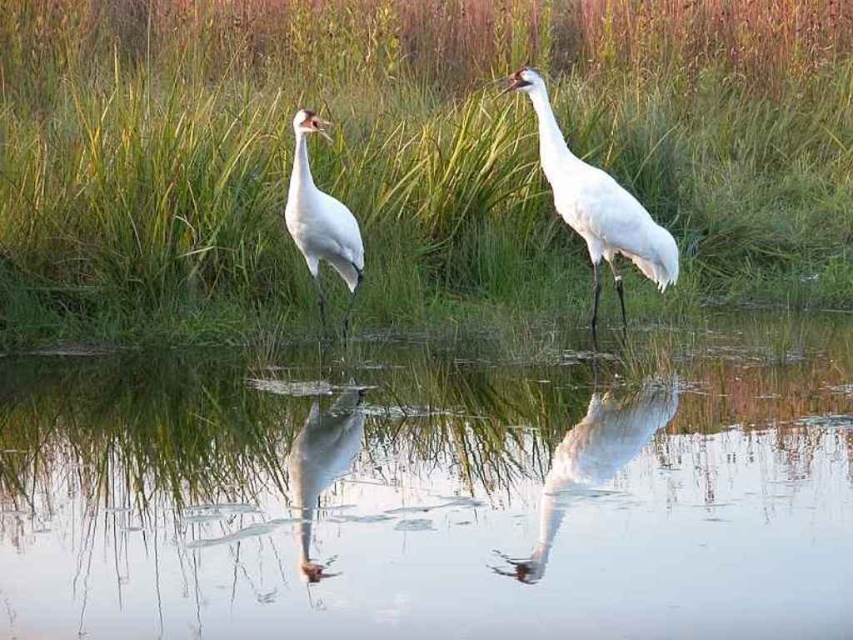
Between white feathered crane at upper center and white feathered crane at left, which one appears on the right side from the viewer's perspective?

white feathered crane at upper center

Can you confirm if white feathered crane at upper center is smaller than white feathered crane at left?

Incorrect, white feathered crane at upper center is not smaller in size than white feathered crane at left.

Describe the element at coordinates (596, 204) in the screenshot. I see `white feathered crane at upper center` at that location.

Image resolution: width=853 pixels, height=640 pixels. Find the location of `white feathered crane at upper center`. white feathered crane at upper center is located at coordinates 596,204.

Is point (764, 429) farther from camera compared to point (300, 113)?

No, (764, 429) is closer to viewer.

Between clear water at center and white feathered crane at left, which one has more height?

Standing taller between the two is white feathered crane at left.

Between point (22, 582) and point (343, 275), which one is positioned behind?

Point (343, 275)

The width and height of the screenshot is (853, 640). Identify the location of clear water at center. (437, 496).

I want to click on green grass at center, so click(x=405, y=148).

Can you confirm if green grass at center is positioned below white feathered crane at upper center?

Actually, green grass at center is above white feathered crane at upper center.

Locate an element on the screen. The image size is (853, 640). green grass at center is located at coordinates (405, 148).

The image size is (853, 640). Identify the location of green grass at center. (405, 148).